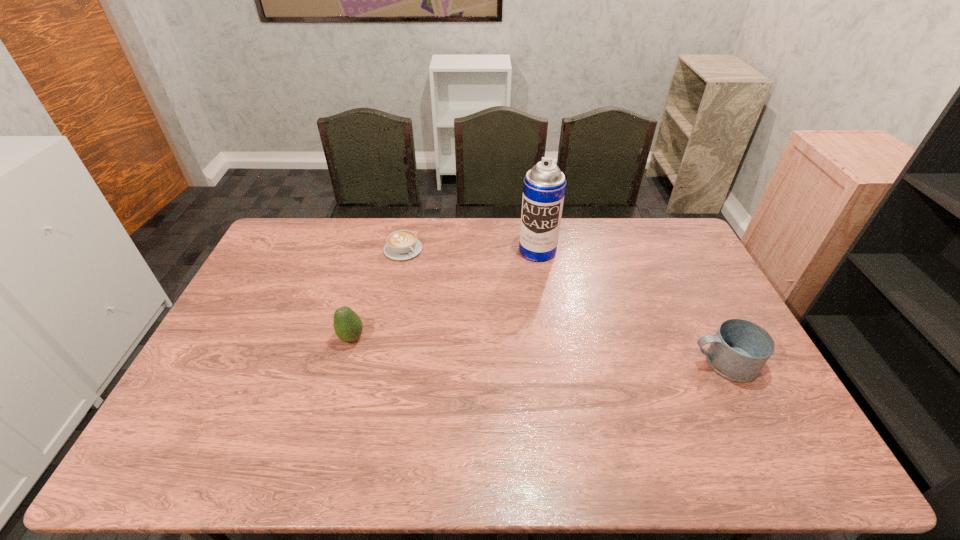
Where is `free spot located on the label side of the tallest object`? Image resolution: width=960 pixels, height=540 pixels. free spot located on the label side of the tallest object is located at coordinates (508, 335).

Locate an element on the screen. This screenshot has height=540, width=960. free space located on the label side of the tallest object is located at coordinates (525, 286).

Identify the location of free spot located on the side of the shortest object with the handle. (437, 279).

This screenshot has width=960, height=540. I want to click on free space located 0.190m on the side of the shortest object with the handle, so click(x=445, y=286).

I want to click on vacant area situated 0.240m on the side of the shortest object with the handle, so click(x=454, y=294).

The image size is (960, 540). In order to click on aerosol can that is positioned at the far edge in this screenshot , I will do `click(544, 186)`.

This screenshot has width=960, height=540. Find the location of `cappuccino positioned at the far edge`. cappuccino positioned at the far edge is located at coordinates (403, 244).

At what (x,y) coordinates should I click in order to perform the action: click on object that is at the right edge. Please return your answer as a coordinate pair (x, y). Image resolution: width=960 pixels, height=540 pixels. Looking at the image, I should click on (740, 349).

At what (x,y) coordinates should I click in order to perform the action: click on free space at the far edge. Please return your answer as a coordinate pair (x, y). This screenshot has width=960, height=540. Looking at the image, I should click on (507, 252).

Identify the location of free region at the near edge of the desktop. Image resolution: width=960 pixels, height=540 pixels. (333, 424).